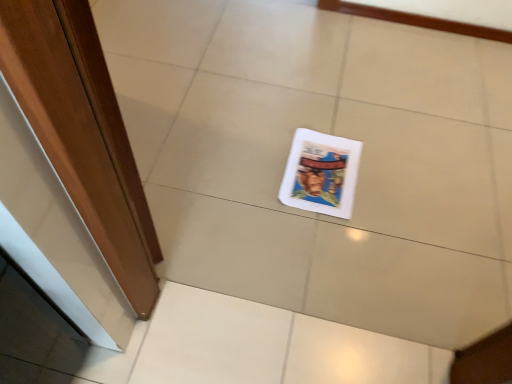
Question: Is wooden door at left not close to white glossy magazine at center?

Choices:
 (A) no
 (B) yes

Answer: (A)

Question: Considering the relative sizes of wooden door at left and white glossy magazine at center in the image provided, is wooden door at left shorter than white glossy magazine at center?

Choices:
 (A) yes
 (B) no

Answer: (B)

Question: Is white glossy magazine at center at the back of wooden door at left?

Choices:
 (A) no
 (B) yes

Answer: (A)

Question: Is the surface of wooden door at left in direct contact with white glossy magazine at center?

Choices:
 (A) no
 (B) yes

Answer: (A)

Question: From the image's perspective, is wooden door at left on white glossy magazine at center?

Choices:
 (A) no
 (B) yes

Answer: (B)

Question: Does wooden door at left have a lesser width compared to white glossy magazine at center?

Choices:
 (A) no
 (B) yes

Answer: (B)

Question: Is white glossy magazine at center bigger than wooden door at left?

Choices:
 (A) yes
 (B) no

Answer: (B)

Question: Can we say white glossy magazine at center lies outside wooden door at left?

Choices:
 (A) yes
 (B) no

Answer: (A)

Question: Does white glossy magazine at center turn towards wooden door at left?

Choices:
 (A) yes
 (B) no

Answer: (B)

Question: Considering the relative sizes of white glossy magazine at center and wooden door at left in the image provided, is white glossy magazine at center thinner than wooden door at left?

Choices:
 (A) yes
 (B) no

Answer: (B)

Question: Is white glossy magazine at center far from wooden door at left?

Choices:
 (A) no
 (B) yes

Answer: (A)

Question: Is white glossy magazine at center further to the viewer compared to wooden door at left?

Choices:
 (A) yes
 (B) no

Answer: (A)

Question: In the image, is wooden door at left positioned in front of or behind white glossy magazine at center?

Choices:
 (A) behind
 (B) front

Answer: (B)